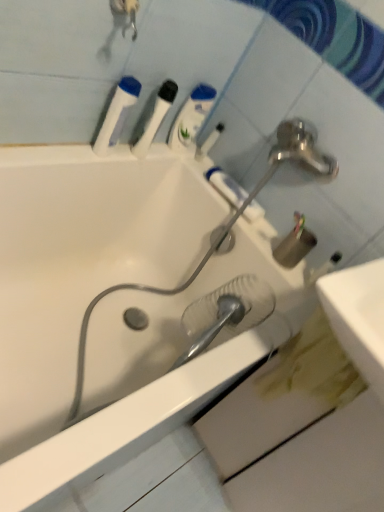
Question: Does white plastic bottle at upper center, which is counted as the first mouthwash, starting from the right, contain translucent plastic shower head at center?

Choices:
 (A) no
 (B) yes

Answer: (A)

Question: Can you confirm if white plastic bottle at upper center, which is counted as the first mouthwash, starting from the right, is positioned to the left of translucent plastic shower head at center?

Choices:
 (A) yes
 (B) no

Answer: (A)

Question: Is white plastic bottle at upper center, which is counted as the first mouthwash, starting from the right, at the right side of translucent plastic shower head at center?

Choices:
 (A) no
 (B) yes

Answer: (A)

Question: From a real-world perspective, is white plastic bottle at upper center, which is counted as the first mouthwash, starting from the right, located beneath translucent plastic shower head at center?

Choices:
 (A) yes
 (B) no

Answer: (B)

Question: Can you confirm if white plastic bottle at upper center, which is counted as the first mouthwash, starting from the right, is bigger than translucent plastic shower head at center?

Choices:
 (A) no
 (B) yes

Answer: (A)

Question: From the image's perspective, is white plastic bottle at upper center, which is counted as the first mouthwash, starting from the right, below translucent plastic shower head at center?

Choices:
 (A) no
 (B) yes

Answer: (A)

Question: Considering the relative sizes of white plastic bottle at upper center, acting as the third mouthwash starting from the left, and white glossy bathtub at center in the image provided, is white plastic bottle at upper center, acting as the third mouthwash starting from the left, shorter than white glossy bathtub at center?

Choices:
 (A) no
 (B) yes

Answer: (B)

Question: Does white plastic bottle at upper center, acting as the third mouthwash starting from the left, come behind white glossy bathtub at center?

Choices:
 (A) yes
 (B) no

Answer: (A)

Question: Is white plastic bottle at upper center, acting as the third mouthwash starting from the left, thinner than white glossy bathtub at center?

Choices:
 (A) no
 (B) yes

Answer: (B)

Question: Can you confirm if white plastic bottle at upper center, which is counted as the first mouthwash, starting from the right, is positioned to the right of white glossy bathtub at center?

Choices:
 (A) yes
 (B) no

Answer: (A)

Question: From the image's perspective, is white plastic bottle at upper center, which is counted as the first mouthwash, starting from the right, beneath white glossy bathtub at center?

Choices:
 (A) yes
 (B) no

Answer: (B)

Question: From a real-world perspective, is white plastic bottle at upper center, which is counted as the first mouthwash, starting from the right, on white glossy bathtub at center?

Choices:
 (A) yes
 (B) no

Answer: (A)

Question: Considering the relative sizes of white matte toothpaste at upper center and white plastic toothbrush at upper center in the image provided, is white matte toothpaste at upper center wider than white plastic toothbrush at upper center?

Choices:
 (A) no
 (B) yes

Answer: (B)